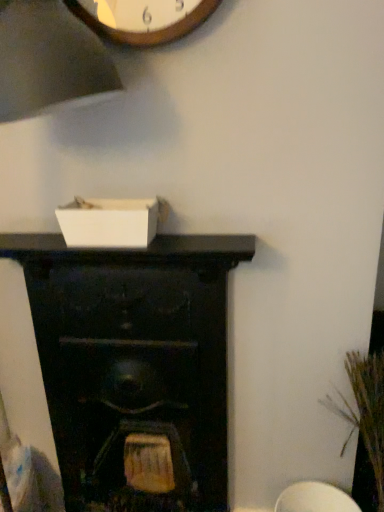
Question: Looking at their shapes, would you say black wood fireplace at center is wider or thinner than brown textured plant at right?

Choices:
 (A) wide
 (B) thin

Answer: (B)

Question: From the image's perspective, is black wood fireplace at center above or below brown textured plant at right?

Choices:
 (A) above
 (B) below

Answer: (A)

Question: Do you think black wood fireplace at center is within brown textured plant at right, or outside of it?

Choices:
 (A) inside
 (B) outside

Answer: (B)

Question: In the image, is brown textured plant at right positioned in front of or behind black wood fireplace at center?

Choices:
 (A) front
 (B) behind

Answer: (A)

Question: Visually, is brown textured plant at right positioned to the left or to the right of black wood fireplace at center?

Choices:
 (A) right
 (B) left

Answer: (A)

Question: Based on their sizes in the image, would you say brown textured plant at right is bigger or smaller than black wood fireplace at center?

Choices:
 (A) big
 (B) small

Answer: (B)

Question: Considering the positions of point (345, 420) and point (203, 326), is point (345, 420) closer or farther from the camera than point (203, 326)?

Choices:
 (A) closer
 (B) farther

Answer: (B)